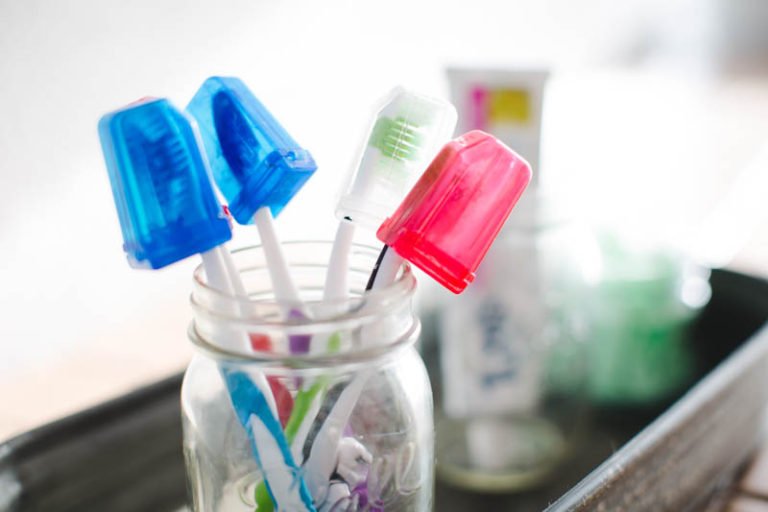
Locate an element on the screen. The image size is (768, 512). two blue toothbrush caps is located at coordinates (161, 206), (249, 148).